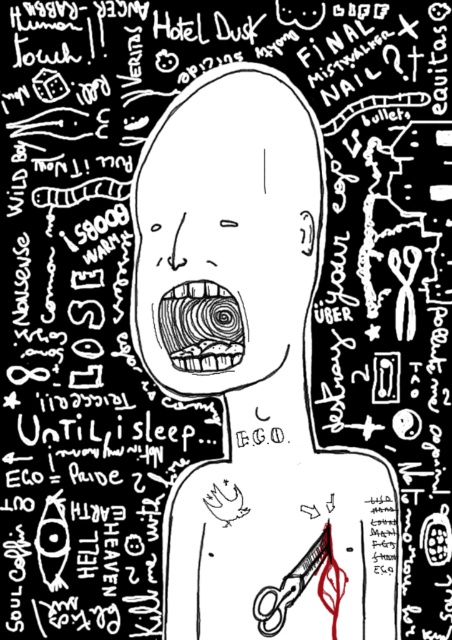
How distant is spiral-patterned teeth at center from metallic sheen scissors at lower right?

spiral-patterned teeth at center is 8.51 inches from metallic sheen scissors at lower right.

Which is below, spiral-patterned teeth at center or metallic sheen scissors at lower right?

metallic sheen scissors at lower right

The image size is (452, 640). I want to click on spiral-patterned teeth at center, so click(x=202, y=326).

Can you confirm if smooth white head at center is bigger than spiral-patterned teeth at center?

Indeed, smooth white head at center has a larger size compared to spiral-patterned teeth at center.

Is point (193, 292) behind point (169, 355)?

No, it is in front of (169, 355).

Where is `smooth white head at center`? This screenshot has width=452, height=640. smooth white head at center is located at coordinates (226, 230).

Which of these two, smooth white head at center or metallic sheen scissors at lower right, stands taller?

With more height is smooth white head at center.

Which is behind, point (272, 113) or point (324, 589)?

The point (324, 589) is behind.

The image size is (452, 640). What are the coordinates of `smooth white head at center` in the screenshot? It's located at (226, 230).